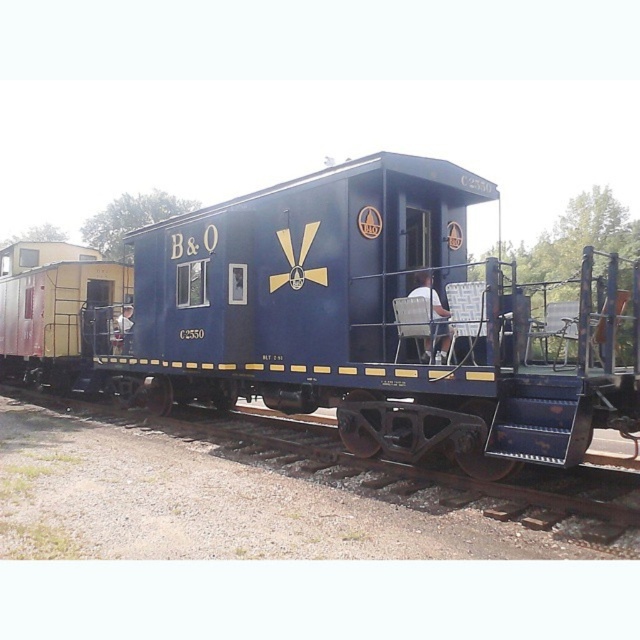
Who is higher up, matte blue caboose at center or rusty metal track at lower center?

matte blue caboose at center is higher up.

Locate an element on the screen. The height and width of the screenshot is (640, 640). matte blue caboose at center is located at coordinates (340, 321).

Is point (593, 374) closer to camera compared to point (572, 540)?

That is False.

The height and width of the screenshot is (640, 640). I want to click on matte blue caboose at center, so click(x=340, y=321).

Between point (200, 424) and point (445, 314), which one is positioned in front?

Point (445, 314) is in front.

Who is shorter, rusty metal track at lower center or white fabric chair at center?

With less height is rusty metal track at lower center.

Locate an element on the screen. The width and height of the screenshot is (640, 640). rusty metal track at lower center is located at coordinates (387, 470).

Does matte blue caboose at center appear on the right side of white fabric chair at center?

Indeed, matte blue caboose at center is positioned on the right side of white fabric chair at center.

Which is in front, point (40, 243) or point (445, 355)?

Point (445, 355)

Image resolution: width=640 pixels, height=640 pixels. What are the coordinates of `matte blue caboose at center` in the screenshot? It's located at (340, 321).